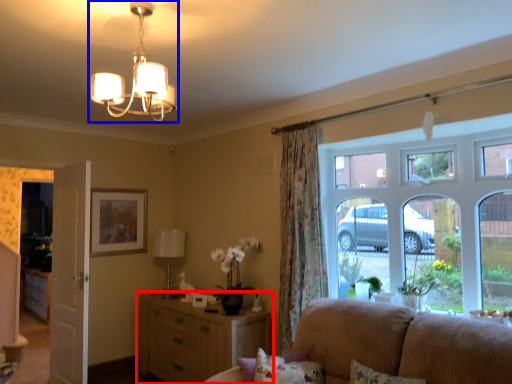
Question: Among these objects, which one is farthest to the camera, cabinetry (highlighted by a red box) or lamp (highlighted by a blue box)?

Choices:
 (A) cabinetry
 (B) lamp

Answer: (A)